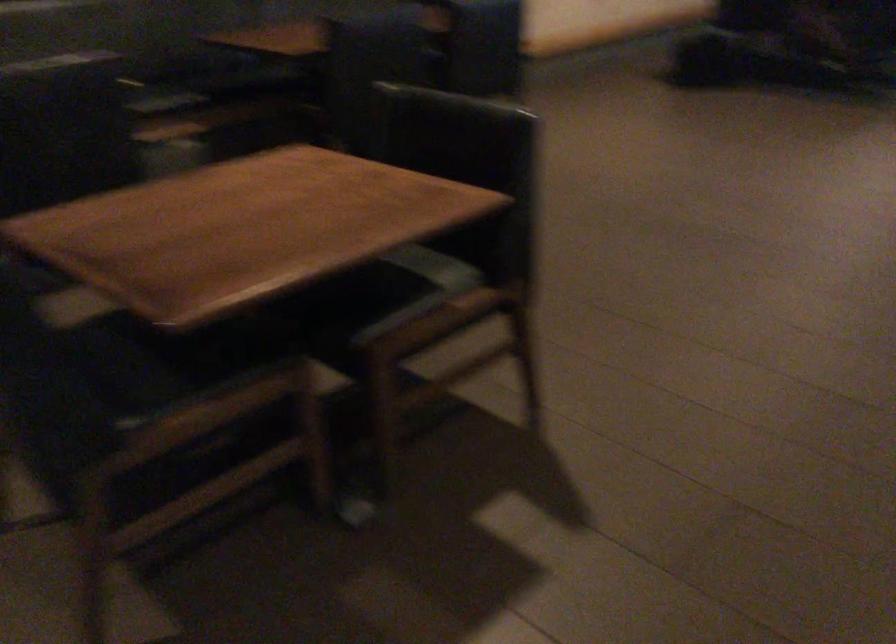
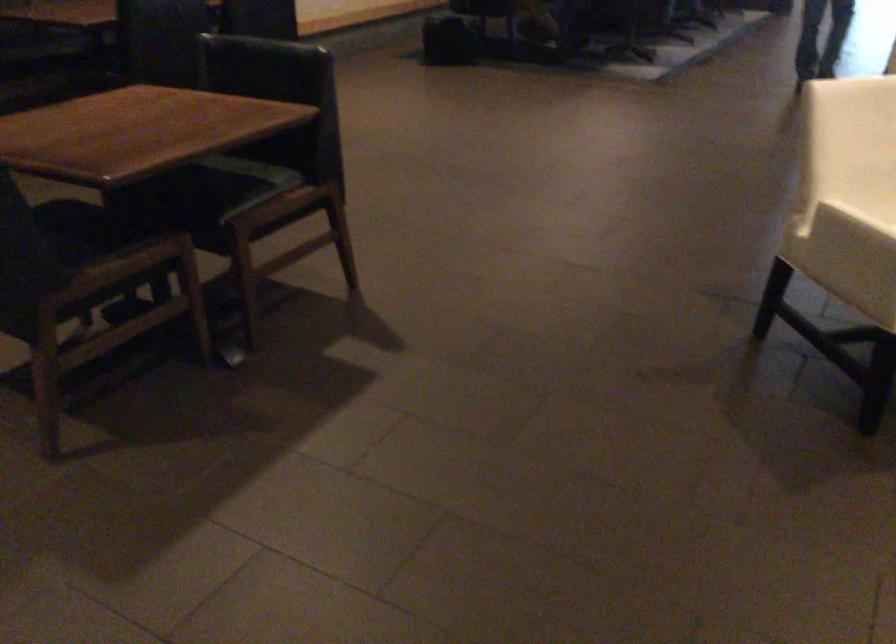
Question: The first image is from the beginning of the video and the second image is from the end. How did the camera likely rotate when shooting the video?

Choices:
 (A) Left
 (B) Right
 (C) Up
 (D) Down

Answer: (B)